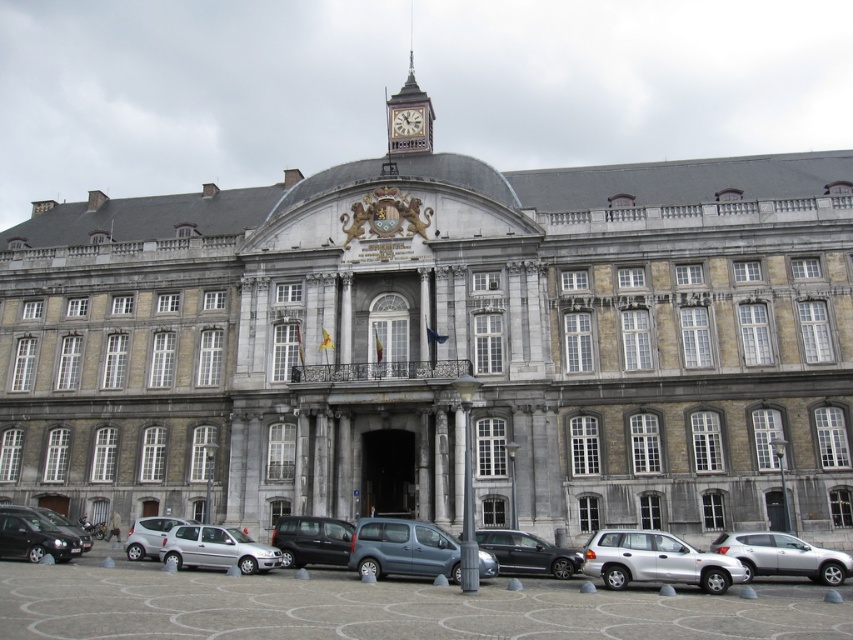
In the scene shown: Is metallic gray van at center wider than matte black van at center?

Incorrect, metallic gray van at center's width does not surpass matte black van at center's.

Is metallic gray van at center taller than matte black van at center?

Incorrect, metallic gray van at center's height is not larger of matte black van at center's.

Is point (451, 538) in front of point (288, 548)?

Yes, point (451, 538) is closer to viewer.

The height and width of the screenshot is (640, 853). What are the coordinates of `metallic gray van at center` in the screenshot? It's located at (403, 548).

Who is positioned more to the left, matte black car at lower left or dark gray stone clock at upper center?

Positioned to the left is matte black car at lower left.

This screenshot has width=853, height=640. What are the coordinates of `matte black car at lower left` in the screenshot? It's located at (33, 538).

Is metallic gray van at center smaller than silver metallic hatchback at lower left?

Yes.

Does metallic gray van at center come behind silver metallic hatchback at lower left?

No, it is not.

Locate an element on the screen. This screenshot has height=640, width=853. metallic gray van at center is located at coordinates (403, 548).

This screenshot has width=853, height=640. I want to click on metallic gray van at center, so click(x=403, y=548).